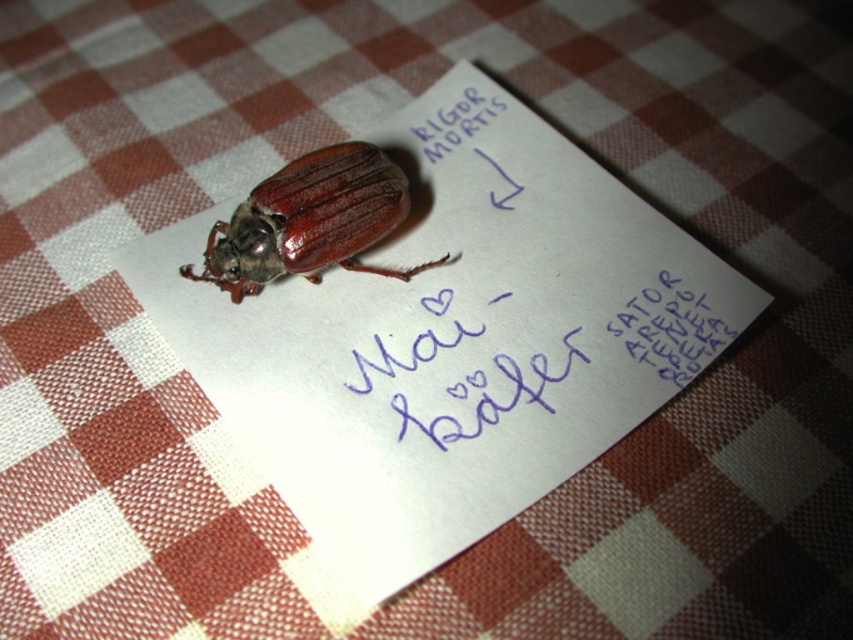
Which is below, shiny brown beetle at center or black paper at upper center?

black paper at upper center is below.

Between shiny brown beetle at center and black paper at upper center, which one is positioned higher?

shiny brown beetle at center is above.

I want to click on shiny brown beetle at center, so click(x=310, y=220).

Locate an element on the screen. The height and width of the screenshot is (640, 853). shiny brown beetle at center is located at coordinates (310, 220).

Between blue ink writing at center and black paper at upper center, which one is positioned higher?

black paper at upper center is above.

Between blue ink writing at center and black paper at upper center, which one appears on the right side from the viewer's perspective?

black paper at upper center

Is point (451, 340) positioned before point (621, 339)?

No, it is not.

I want to click on blue ink writing at center, so click(x=457, y=371).

What do you see at coordinates (310, 220) in the screenshot? I see `shiny brown beetle at center` at bounding box center [310, 220].

Is shiny brown beetle at center thinner than blue ink writing at center?

Incorrect, shiny brown beetle at center's width is not less than blue ink writing at center's.

Is point (386, 157) farther from viewer compared to point (511, 387)?

Yes, it is behind point (511, 387).

Locate an element on the screen. shiny brown beetle at center is located at coordinates (310, 220).